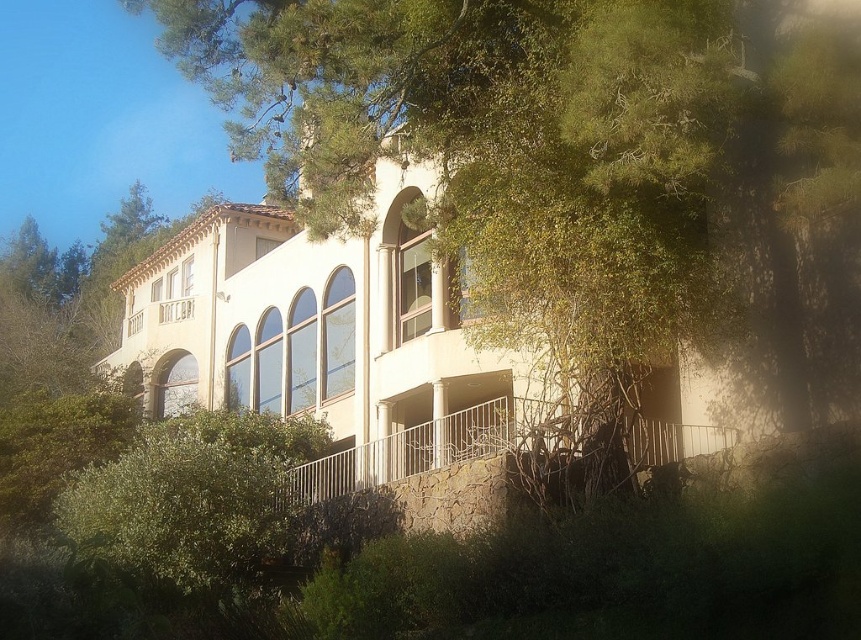
You are standing in front of the building and want to determine which object is taller between the white stucco villa at center and the white metal railing at lower center. Based on the scene, which one is taller?

The white stucco villa at center is taller than the white metal railing at lower center.

You are standing in a park and see the white stucco villa at center. If you want to take a photo of it from a distance of 30 meters, should you move closer or further away?

The white stucco villa at center is currently 34.13 meters away. To achieve a 30 meter distance, you need to move closer by approximately 4.13 meters.